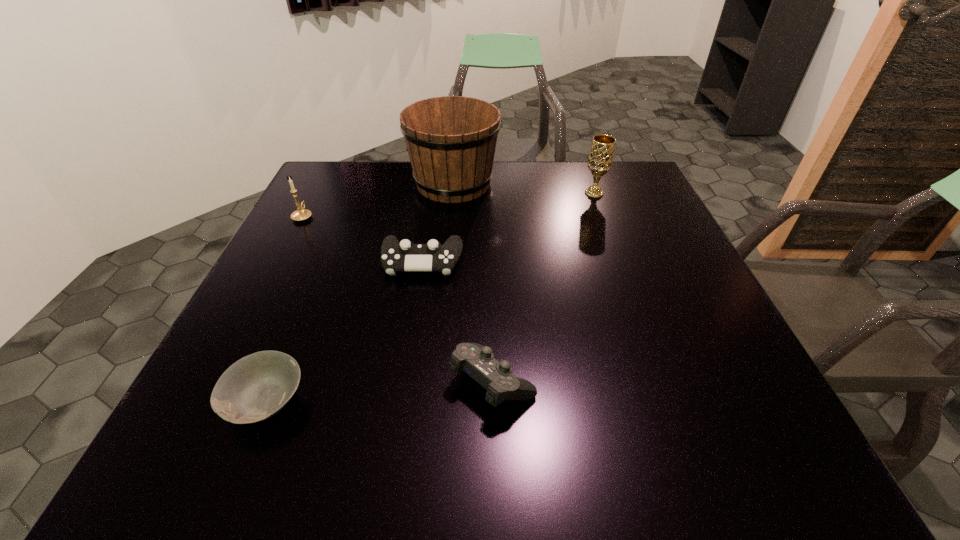
This screenshot has height=540, width=960. Identify the location of object identified as the third closest to the nearer control. (451, 141).

You are a GUI agent. You are given a task and a screenshot of the screen. Output one action in this format:
    pyautogui.click(x=<x>, y=<y>)
    Task: Click on the vacant area in the image that satisfies the following two spatial constraints: 1. on the handle side of the third tallest object; 2. on the right side of the fifth shortest object
    
    Given the screenshot: What is the action you would take?
    pyautogui.click(x=315, y=193)

At what (x,y) coordinates should I click in order to perform the action: click on vacant space that satisfies the following two spatial constraints: 1. on the handle side of the wine bucket; 2. on the right side of the leftmost object. Please return your answer as a coordinate pair (x, y). The image size is (960, 540). Looking at the image, I should click on (321, 184).

Identify the location of vacant space that satisfies the following two spatial constraints: 1. on the handle side of the candle holder; 2. on the right side of the chalice. This screenshot has height=540, width=960. (315, 193).

Locate an element on the screen. The image size is (960, 540). blank space that satisfies the following two spatial constraints: 1. on the back side of the nearer control; 2. on the left side of the chalice is located at coordinates (x=488, y=193).